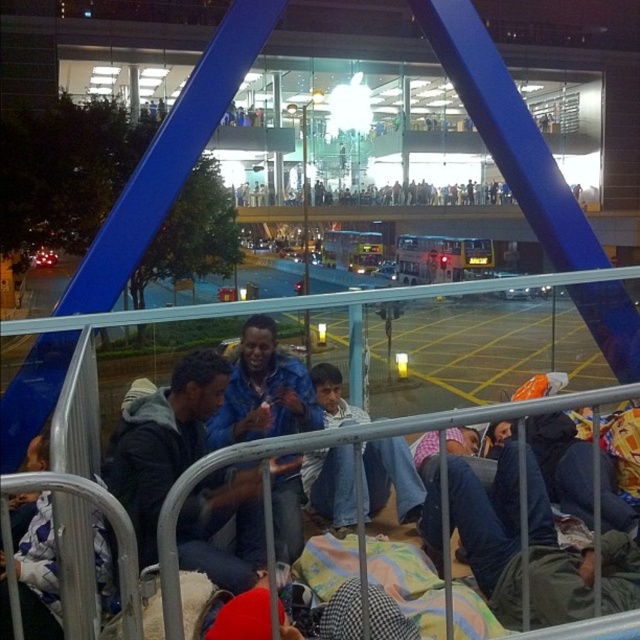
Is blue denim jacket at center below denim jacket at lower right?

Incorrect, blue denim jacket at center is not positioned below denim jacket at lower right.

What do you see at coordinates (163, 442) in the screenshot? The image size is (640, 640). I see `blue denim jacket at center` at bounding box center [163, 442].

This screenshot has width=640, height=640. Find the location of `blue denim jacket at center`. blue denim jacket at center is located at coordinates (163, 442).

What do you see at coordinates (490, 529) in the screenshot? I see `denim jacket at lower right` at bounding box center [490, 529].

Does denim jacket at lower right come behind metallic gray rail at lower center?

Yes, denim jacket at lower right is behind metallic gray rail at lower center.

What do you see at coordinates (490, 529) in the screenshot?
I see `denim jacket at lower right` at bounding box center [490, 529].

This screenshot has width=640, height=640. What are the coordinates of `denim jacket at lower right` in the screenshot? It's located at (490, 529).

Is denim jacket at lower right above jeans at center?

No.

Image resolution: width=640 pixels, height=640 pixels. I want to click on denim jacket at lower right, so (x=490, y=529).

Where is `denim jacket at lower right`? denim jacket at lower right is located at coordinates [x=490, y=529].